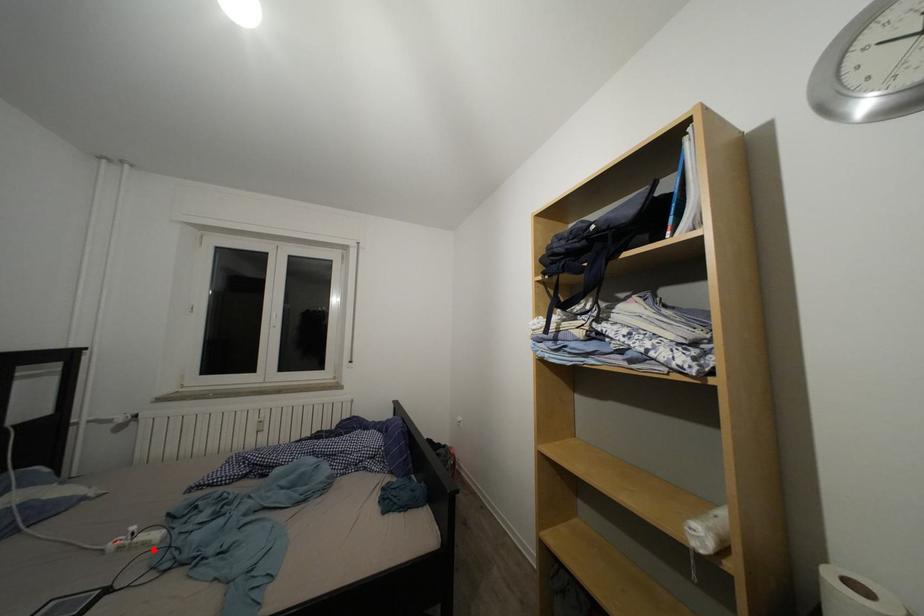
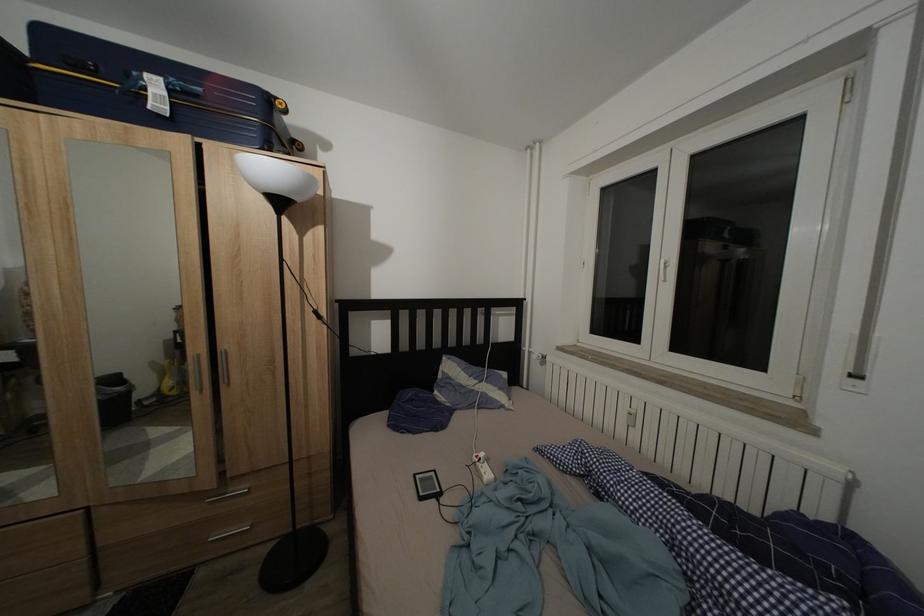
Question: I am providing you with two images of the same scene from different viewpoints. Given a red point in image1, look at the same physical point in image2. Is it:

Choices:
 (A) Closer to the viewpoint
 (B) Farther from the viewpoint

Answer: (B)